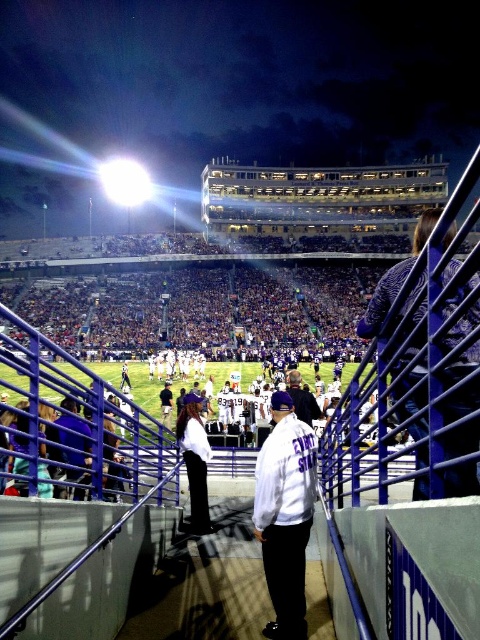
Can you confirm if white matte jacket at center is taller than white shirt at center?

Yes.

The width and height of the screenshot is (480, 640). What do you see at coordinates (285, 515) in the screenshot? I see `white matte jacket at center` at bounding box center [285, 515].

What do you see at coordinates (285, 515) in the screenshot?
I see `white matte jacket at center` at bounding box center [285, 515].

The height and width of the screenshot is (640, 480). In order to click on white matte jacket at center in this screenshot , I will do `click(285, 515)`.

Is point (479, 314) closer to viewer compared to point (177, 429)?

Yes, it is in front of point (177, 429).

Is patterned fabric jacket at right to the left of white shirt at center from the viewer's perspective?

In fact, patterned fabric jacket at right is to the right of white shirt at center.

Does point (424, 364) come closer to viewer compared to point (191, 401)?

Yes, point (424, 364) is closer to viewer.

This screenshot has height=640, width=480. Identify the location of patterned fabric jacket at right. (395, 278).

Who is more distant from viewer, (458, 436) or (269, 582)?

Point (269, 582)

Between patterned fabric jacket at right and white matte jacket at center, which one has less height?

white matte jacket at center

Describe the element at coordinates (395, 278) in the screenshot. I see `patterned fabric jacket at right` at that location.

Locate an element on the screen. The width and height of the screenshot is (480, 640). patterned fabric jacket at right is located at coordinates (395, 278).